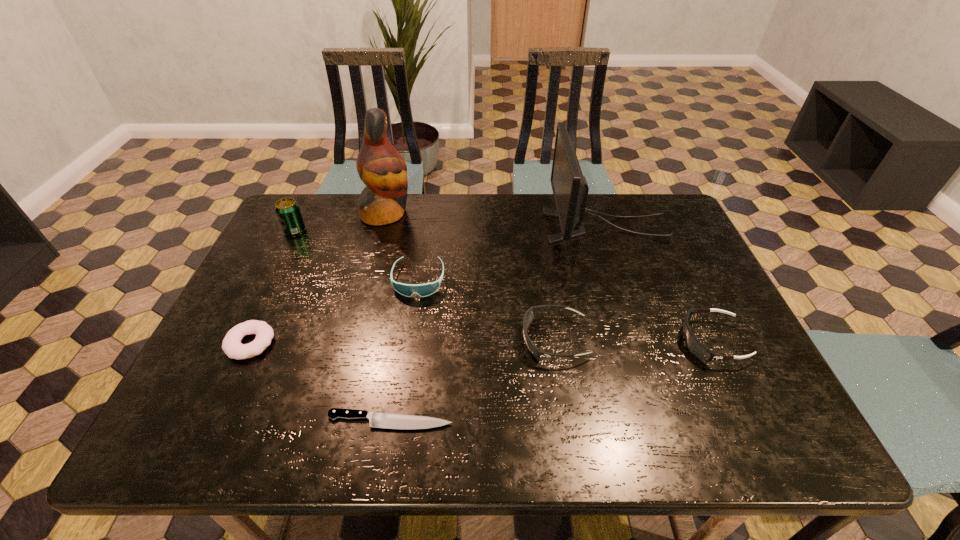
The height and width of the screenshot is (540, 960). In order to click on blank space located on the front and sides of the rightmost goggles in this screenshot , I will do `click(601, 341)`.

The height and width of the screenshot is (540, 960). I want to click on free space located 0.220m on the front-facing side of the leftmost goggles, so click(405, 371).

At what (x,y) coordinates should I click in order to perform the action: click on vacant space located on the right of the doughnut. Please return your answer as a coordinate pair (x, y). Looking at the image, I should click on (307, 343).

Where is `vacant area situated on the back of the steak knife`? This screenshot has width=960, height=540. vacant area situated on the back of the steak knife is located at coordinates (410, 294).

In order to click on parrot that is at the far edge in this screenshot , I will do `click(380, 166)`.

Identify the location of computer monitor that is at the far edge. This screenshot has height=540, width=960. (570, 189).

Find the location of a particular element. This screenshot has height=540, width=960. beer can situated at the far edge is located at coordinates (287, 210).

Image resolution: width=960 pixels, height=540 pixels. Find the location of `object that is positioned at the near edge`. object that is positioned at the near edge is located at coordinates (377, 420).

You are a GUI agent. You are given a task and a screenshot of the screen. Output one action in this format:
    pyautogui.click(x=<x>, y=<y>)
    Task: Click on the beer can situated at the left edge
    This screenshot has height=540, width=960.
    Given the screenshot: What is the action you would take?
    pyautogui.click(x=287, y=210)

What are the coordinates of `doughnut located in the left edge section of the desktop` in the screenshot? It's located at (231, 345).